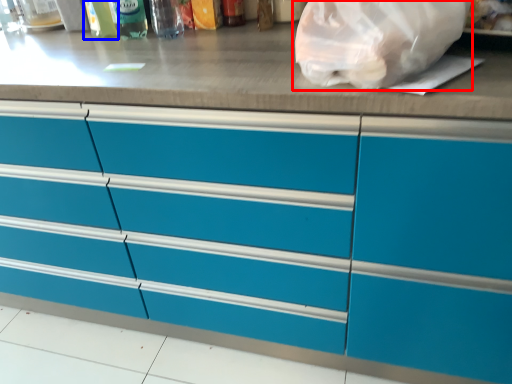
Question: Which of the following is the closest to the observer, plastic bag (highlighted by a red box) or bottle (highlighted by a blue box)?

Choices:
 (A) plastic bag
 (B) bottle

Answer: (A)